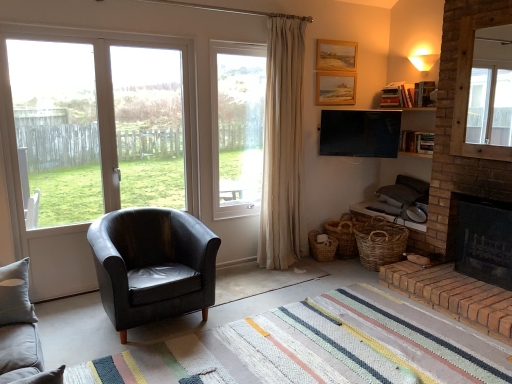
What do you see at coordinates (282, 144) in the screenshot?
I see `beige fabric curtain at upper center` at bounding box center [282, 144].

I want to click on rug at center, so coord(307,349).

At what (x,y) coordinates should I click in order to perform the action: click on flat screen tv at upper center. Please return your answer as a coordinate pair (x, y). The width and height of the screenshot is (512, 384). Looking at the image, I should click on (359, 133).

In the image, is flat screen tv at upper center on the left side or the right side of rug at center?

flat screen tv at upper center is to the right of rug at center.

Are flat screen tv at upper center and rug at center beside each other?

There is a gap between flat screen tv at upper center and rug at center.

Which of these two, flat screen tv at upper center or rug at center, is smaller?

flat screen tv at upper center is smaller.

Does transparent glass window at left, which is the 2th window screen in left-to-right order, have a lesser width compared to brick fireplace at right, the second fireplace in the bottom-to-top sequence?

Yes.

Is transparent glass window at left, which is the 2th window screen in left-to-right order, positioned with its back to brick fireplace at right, which is the 1th fireplace in top-to-bottom order?

transparent glass window at left, which is the 2th window screen in left-to-right order, does not have its back to brick fireplace at right, which is the 1th fireplace in top-to-bottom order.

From the image's perspective, would you say transparent glass window at left, marked as the first window screen in a right-to-left arrangement, is positioned over brick fireplace at right, which is the 1th fireplace in top-to-bottom order?

Indeed, from the image's perspective, transparent glass window at left, marked as the first window screen in a right-to-left arrangement, is shown above brick fireplace at right, which is the 1th fireplace in top-to-bottom order.

Is transparent glass window at left, marked as the first window screen in a right-to-left arrangement, closer to camera compared to brick fireplace at right, which is the 1th fireplace in top-to-bottom order?

No, transparent glass window at left, marked as the first window screen in a right-to-left arrangement, is further to the viewer.

This screenshot has width=512, height=384. I want to click on studio couch lying on the left of brown brick fireplace at lower right, positioned as the 1th fireplace in bottom-to-top order, so click(20, 331).

Is brown brick fireplace at lower right, the 2th fireplace positioned from the top, in contact with gray fabric studio couch at lower left?

brown brick fireplace at lower right, the 2th fireplace positioned from the top, and gray fabric studio couch at lower left are not in contact.

Measure the distance from brown brick fireplace at lower right, the 2th fireplace positioned from the top, to gray fabric studio couch at lower left.

9.28 feet.

Is brown brick fireplace at lower right, positioned as the 1th fireplace in bottom-to-top order, oriented away from gray fabric studio couch at lower left?

No, brown brick fireplace at lower right, positioned as the 1th fireplace in bottom-to-top order,'s orientation is not away from gray fabric studio couch at lower left.

Is woven brown baskets at lower right, which is counted as the first basket, starting from the right, taller or shorter than brick fireplace at right, the second fireplace in the bottom-to-top sequence?

woven brown baskets at lower right, which is counted as the first basket, starting from the right, is shorter than brick fireplace at right, the second fireplace in the bottom-to-top sequence.

Between woven brown baskets at lower right, which is counted as the first basket, starting from the right, and brick fireplace at right, which is the 1th fireplace in top-to-bottom order, which one appears on the right side from the viewer's perspective?

brick fireplace at right, which is the 1th fireplace in top-to-bottom order, is more to the right.

Which is closer to the camera, (400,236) or (500,239)?

Positioned in front is point (500,239).

Is transparent glass window at left, the first window positioned from the left, with beige fabric curtain at upper center?

No, transparent glass window at left, the first window positioned from the left, is not making contact with beige fabric curtain at upper center.

Does transparent glass window at left, which ranks as the second window in right-to-left order, have a greater width compared to beige fabric curtain at upper center?

No.

Consider the image. Is transparent glass window at left, which ranks as the second window in right-to-left order, further to camera compared to beige fabric curtain at upper center?

No, the depth of transparent glass window at left, which ranks as the second window in right-to-left order, is less than that of beige fabric curtain at upper center.

Who is smaller, transparent glass window at left, which ranks as the second window in right-to-left order, or beige fabric curtain at upper center?

transparent glass window at left, which ranks as the second window in right-to-left order, is smaller.

In the scene shown: Between transparent glass door at left, which is the 2th window screen in right-to-left order, and brick fireplace at right, which is the 1th fireplace in top-to-bottom order, which one has larger width?

brick fireplace at right, which is the 1th fireplace in top-to-bottom order.

In the scene shown: Considering the positions of objects transparent glass door at left, which is counted as the first window screen, starting from the left, and brick fireplace at right, the second fireplace in the bottom-to-top sequence, in the image provided, who is in front, transparent glass door at left, which is counted as the first window screen, starting from the left, or brick fireplace at right, the second fireplace in the bottom-to-top sequence,?

transparent glass door at left, which is counted as the first window screen, starting from the left, is more forward.

What's the angular difference between transparent glass door at left, which is counted as the first window screen, starting from the left, and brick fireplace at right, which is the 1th fireplace in top-to-bottom order,'s facing directions?

89.8 degrees.

Does transparent glass window at left, marked as the first window screen in a right-to-left arrangement, have a lesser height compared to rug at center?

In fact, transparent glass window at left, marked as the first window screen in a right-to-left arrangement, may be taller than rug at center.

Is transparent glass window at left, which is the 2th window screen in left-to-right order, with rug at center?

transparent glass window at left, which is the 2th window screen in left-to-right order, is not next to rug at center, and they're not touching.

Which object is wider, transparent glass window at left, marked as the first window screen in a right-to-left arrangement, or rug at center?

Wider between the two is rug at center.

Considering the sizes of transparent glass window at left, which is the 2th window screen in left-to-right order, and rug at center in the image, is transparent glass window at left, which is the 2th window screen in left-to-right order, bigger or smaller than rug at center?

transparent glass window at left, which is the 2th window screen in left-to-right order, is smaller than rug at center.

Find the location of a particular element. plain in front of the flat screen tv at upper center is located at coordinates (307, 349).

There is a brick fireplace at right, which is the 1th fireplace in top-to-bottom order. Find the location of `the 2nd window screen above it (from the image's perspective)`. the 2nd window screen above it (from the image's perspective) is located at coordinates (149, 126).

From the image, which object appears to be farther from rug at center, woven brown baskets at lower right, which is counted as the first basket, starting from the right, or gray fabric studio couch at lower left?

Based on the image, woven brown baskets at lower right, which is counted as the first basket, starting from the right, appears to be further to rug at center.

Based on their spatial positions, is black leather armchair at center or woven brown basket at lower right, which is the first basket from left to right, further from transparent glass window at left, which ranks as the second window in right-to-left order?

woven brown basket at lower right, which is the first basket from left to right.

Based on their spatial positions, is black leather armchair at center or woven brown basket at lower right, the second basket when ordered from right to left, further from brown brick fireplace at lower right, the 2th fireplace positioned from the top?

black leather armchair at center.

Based on their spatial positions, is woven brown basket at lower right, which is the first basket from left to right, or clear glass window at center, marked as the 2th window in a left-to-right arrangement, further from rug at center?

Based on the image, clear glass window at center, marked as the 2th window in a left-to-right arrangement, appears to be further to rug at center.

When comparing their distances from woven brown baskets at lower right, which is counted as the first basket, starting from the right, does wooden picture frame at upper center, the 1th picture frame in the bottom-to-top sequence, or woven brown basket at lower right, which is the first basket from left to right, seem closer?

Among the two, woven brown basket at lower right, which is the first basket from left to right, is located nearer to woven brown baskets at lower right, which is counted as the first basket, starting from the right.

From the image, which object appears to be nearer to wooden picture frame at upper center, which is the 2th picture frame from bottom to top, transparent glass door at left, which is counted as the first window screen, starting from the left, or clear glass window at center, which is the 1th window in right-to-left order?

clear glass window at center, which is the 1th window in right-to-left order, is closer to wooden picture frame at upper center, which is the 2th picture frame from bottom to top.

When comparing their distances from transparent glass door at left, which is counted as the first window screen, starting from the left, does wooden picture frame at upper center, the second picture frame from the top, or brown brick fireplace at lower right, the 2th fireplace positioned from the top, seem further?

Among the two, brown brick fireplace at lower right, the 2th fireplace positioned from the top, is located further to transparent glass door at left, which is counted as the first window screen, starting from the left.

From the image, which object appears to be farther from clear glass window at center, which is the 1th window in right-to-left order, brown brick fireplace at lower right, positioned as the 1th fireplace in bottom-to-top order, or transparent glass window at left, the first window positioned from the left?

The object further to clear glass window at center, which is the 1th window in right-to-left order, is brown brick fireplace at lower right, positioned as the 1th fireplace in bottom-to-top order.

Where is `television positioned between rug at center and wooden picture frame at upper center, the second picture frame from the top, from near to far`? television positioned between rug at center and wooden picture frame at upper center, the second picture frame from the top, from near to far is located at coordinates (359, 133).

You are a GUI agent. You are given a task and a screenshot of the screen. Output one action in this format:
    pyautogui.click(x=<x>, y=<y>)
    Task: Click on the window between transparent glass window at left, marked as the first window screen in a right-to-left arrangement, and woven brown baskets at lower right, which is counted as the first basket, starting from the right
    The height and width of the screenshot is (384, 512).
    Given the screenshot: What is the action you would take?
    pyautogui.click(x=237, y=127)

The width and height of the screenshot is (512, 384). I want to click on window screen between transparent glass window at left, marked as the first window screen in a right-to-left arrangement, and black leather armchair at center in the up-down direction, so click(58, 127).

You are a GUI agent. You are given a task and a screenshot of the screen. Output one action in this format:
    pyautogui.click(x=<x>, y=<y>)
    Task: Click on the window screen between transparent glass door at left, which is counted as the first window screen, starting from the left, and brown brick fireplace at lower right, positioned as the 1th fireplace in bottom-to-top order, in the horizontal direction
    Image resolution: width=512 pixels, height=384 pixels.
    Given the screenshot: What is the action you would take?
    pyautogui.click(x=149, y=126)